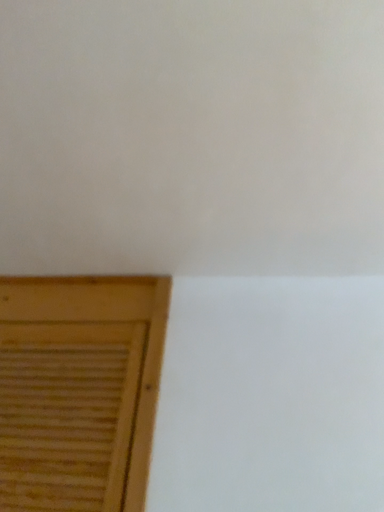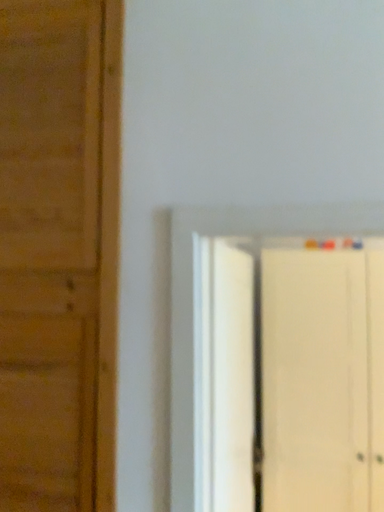
Question: How did the camera likely rotate when shooting the video?

Choices:
 (A) rotated downward
 (B) rotated upward

Answer: (A)